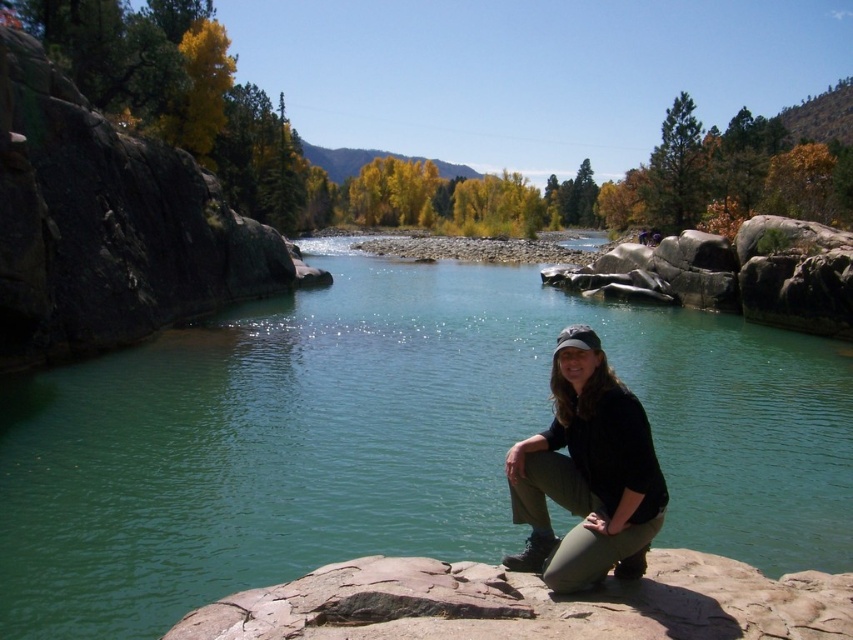
Question: Which object is closer to the camera taking this photo?

Choices:
 (A) clear water at center
 (B) black matte pants at lower center

Answer: (B)

Question: Where is clear water at center located in relation to black matte pants at lower center in the image?

Choices:
 (A) left
 (B) right

Answer: (B)

Question: Which point is closer to the camera taking this photo?

Choices:
 (A) pyautogui.click(x=602, y=492)
 (B) pyautogui.click(x=509, y=332)

Answer: (A)

Question: In this image, where is clear water at center located relative to black matte pants at lower center?

Choices:
 (A) left
 (B) right

Answer: (B)

Question: Can you confirm if clear water at center is positioned above black matte pants at lower center?

Choices:
 (A) no
 (B) yes

Answer: (B)